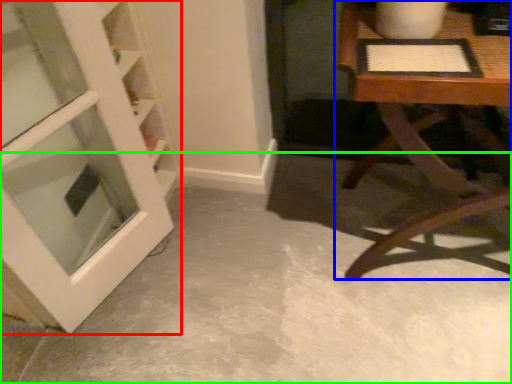
Question: Which object is the farthest from door (highlighted by a red box)? Choose among these: table (highlighted by a blue box) or concrete (highlighted by a green box).

Choices:
 (A) table
 (B) concrete

Answer: (A)